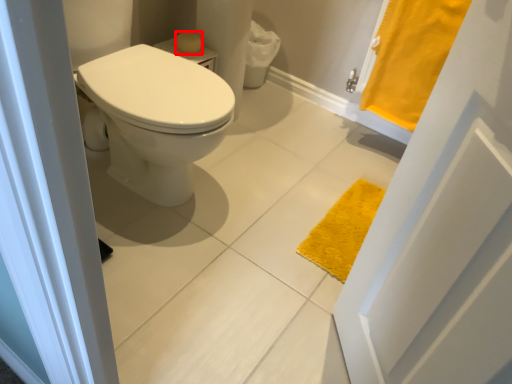
Question: From the image, what is the correct spatial relationship of soap (annotated by the red box) in relation to bath towel?

Choices:
 (A) right
 (B) left

Answer: (B)